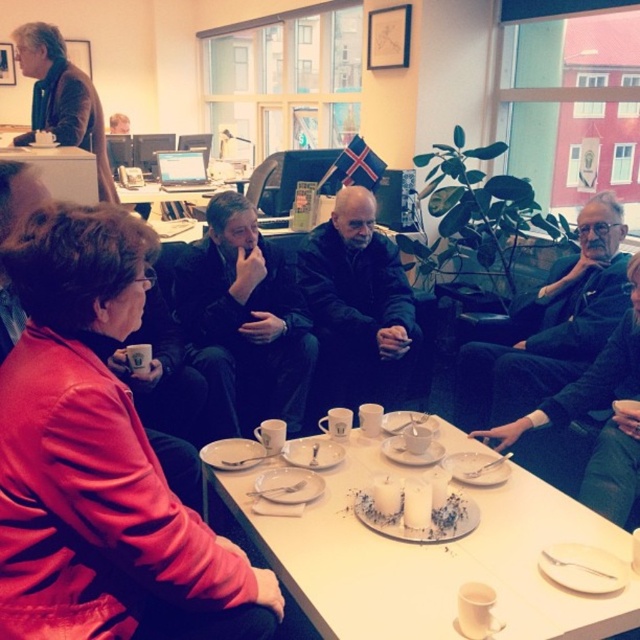
Question: Does black leather jacket at center appear on the right side of white ceramic saucer at center?

Choices:
 (A) no
 (B) yes

Answer: (A)

Question: Which is farther from the white ceramic table at center?

Choices:
 (A) white ceramic saucer at center
 (B) dark gray suit at lower right

Answer: (B)

Question: Which of the following is the farthest from the observer?

Choices:
 (A) (76, 128)
 (B) (356, 216)
 (C) (45, 157)
 (D) (536, 536)

Answer: (A)

Question: Which object appears farthest from the camera in this image?

Choices:
 (A) matte black jacket at center
 (B) white ceramic table at center
 (C) dark gray suit at lower right

Answer: (A)

Question: Can you confirm if matte red jacket at lower left is smaller than brown leather jacket at upper left?

Choices:
 (A) no
 (B) yes

Answer: (B)

Question: Does matte red jacket at lower left appear over white ceramic table at center?

Choices:
 (A) yes
 (B) no

Answer: (A)